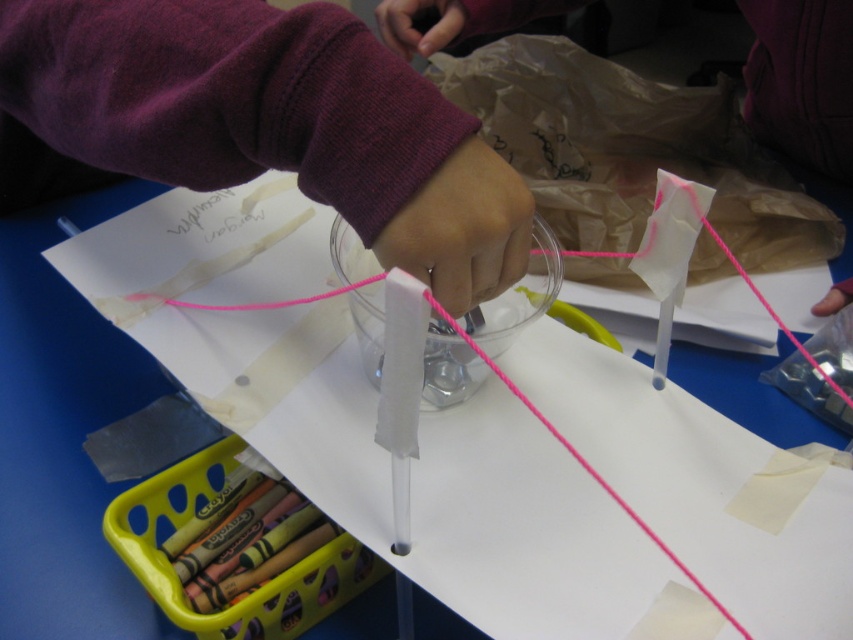
Is purple fleece sleeve at upper center above pink matte string at center?

No.

Does point (434, 237) come farther from viewer compared to point (502, 8)?

No.

Where is `purple fleece sleeve at upper center`? Image resolution: width=853 pixels, height=640 pixels. purple fleece sleeve at upper center is located at coordinates (271, 122).

At what (x,y) coordinates should I click in order to perform the action: click on purple fleece sleeve at upper center. Please return your answer as a coordinate pair (x, y). The height and width of the screenshot is (640, 853). Looking at the image, I should click on (271, 122).

Which is in front, point (584, 538) or point (305, 136)?

Point (305, 136) is in front.

Does white matte paper at center have a lesser width compared to purple fleece sleeve at upper center?

In fact, white matte paper at center might be wider than purple fleece sleeve at upper center.

Describe the element at coordinates (473, 508) in the screenshot. I see `white matte paper at center` at that location.

At what (x,y) coordinates should I click in order to perform the action: click on white matte paper at center. Please return your answer as a coordinate pair (x, y). Image resolution: width=853 pixels, height=640 pixels. Looking at the image, I should click on (473, 508).

Is white matte paper at center above pink matte string at center?

No, white matte paper at center is not above pink matte string at center.

Between white matte paper at center and pink matte string at center, which one appears on the right side from the viewer's perspective?

From the viewer's perspective, pink matte string at center appears more on the right side.

At what (x,y) coordinates should I click in order to perform the action: click on white matte paper at center. Please return your answer as a coordinate pair (x, y). The image size is (853, 640). Looking at the image, I should click on (473, 508).

At what (x,y) coordinates should I click in order to perform the action: click on white matte paper at center. Please return your answer as a coordinate pair (x, y). This screenshot has width=853, height=640. Looking at the image, I should click on (473, 508).